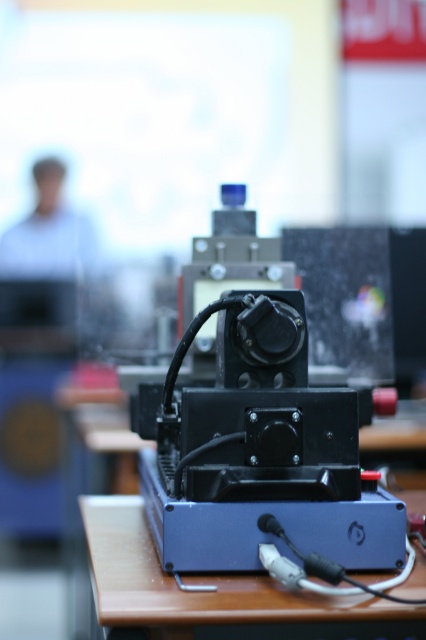
You are a technician working in a lab. You need to place a metallic black machine at center on a blue plastic table at center. How far apart are these two objects currently?

The metallic black machine at center is 6.85 inches away from the blue plastic table at center, so they are currently 6.85 inches apart.

You are a technician working in a lab. You need to reach the wires under the metallic black machine at center to fix a connection. Can you easily access them without moving the blue plastic table at center?

The metallic black machine at center is further to the viewer than the blue plastic table at center, so the machine is closer to you. This means the wires under the machine are more accessible without needing to move the table.